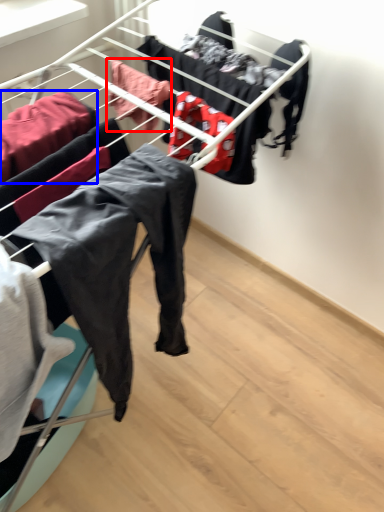
Question: Among these objects, which one is nearest to the camera, clothing (highlighted by a red box) or clothing (highlighted by a blue box)?

Choices:
 (A) clothing
 (B) clothing

Answer: (B)